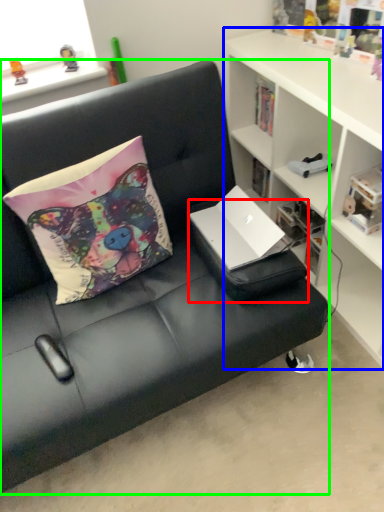
Question: Based on their relative distances, which object is farther from footrest (highlighted by a red box)? Choose from cabinetry (highlighted by a blue box) and studio couch (highlighted by a green box).

Choices:
 (A) cabinetry
 (B) studio couch

Answer: (A)